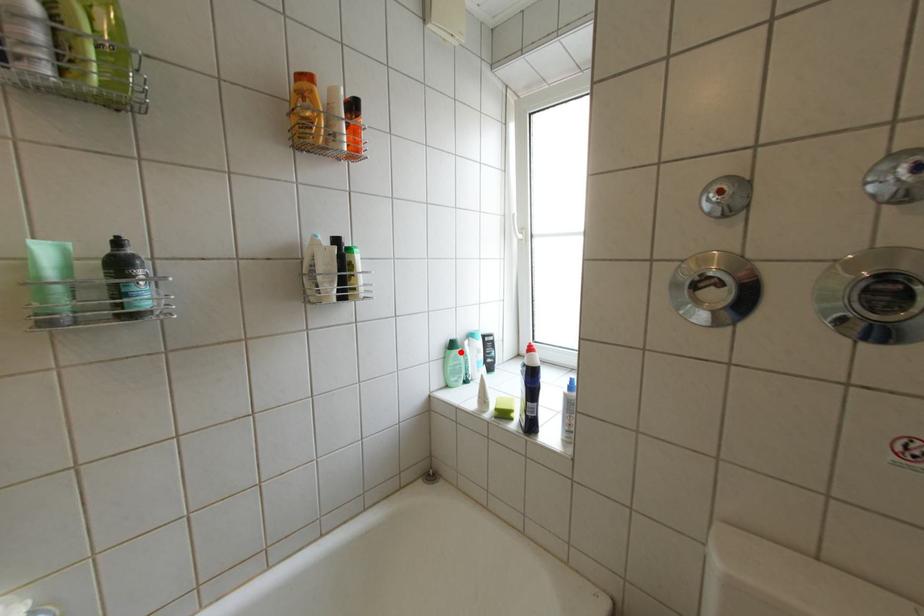
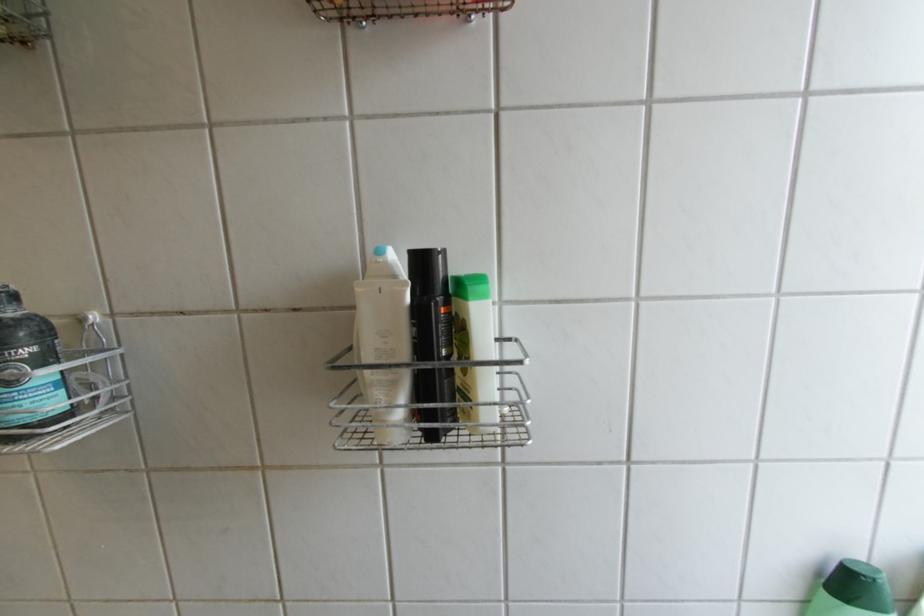
Question: I am providing you with two images of the same scene from different viewpoints. Given a red point in image1, look at the same physical point in image2. Is it:

Choices:
 (A) Closer to the viewpoint
 (B) Farther from the viewpoint

Answer: (A)